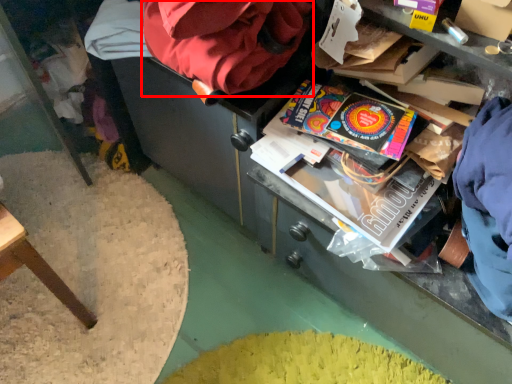
Question: From the image's perspective, considering the relative positions of bean bag chair (annotated by the red box) and paperback book in the image provided, where is bean bag chair (annotated by the red box) located with respect to the staircase?

Choices:
 (A) below
 (B) above

Answer: (B)